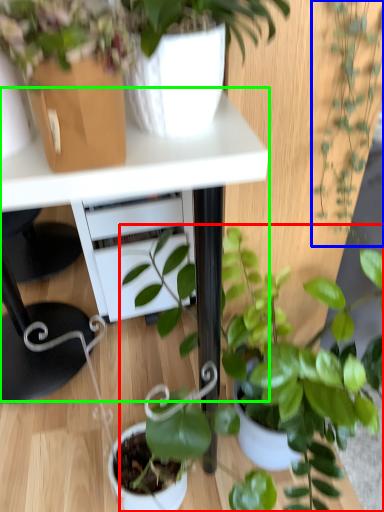
Question: Estimate the real-world distances between objects in this image. Which object is farther from houseplant (highlighted by a red box), houseplant (highlighted by a blue box) or table (highlighted by a green box)?

Choices:
 (A) houseplant
 (B) table

Answer: (B)